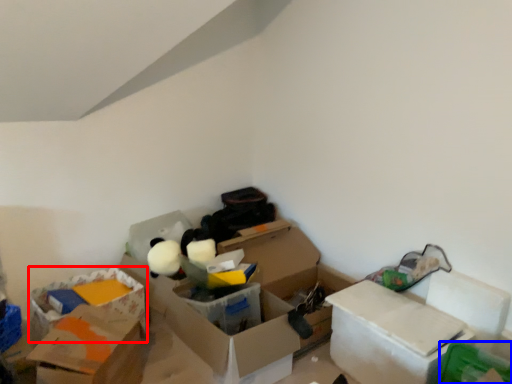
Question: Among these objects, which one is farthest to the camera, storage box (highlighted by a red box) or storage box (highlighted by a blue box)?

Choices:
 (A) storage box
 (B) storage box

Answer: (A)